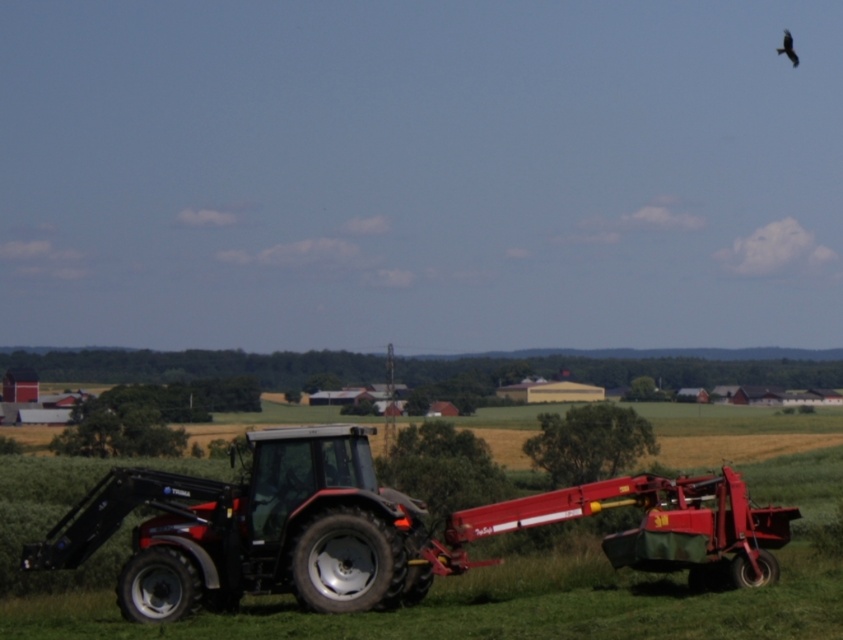
Is matte black tractor at center smaller than black feathered bird at upper right?

Yes.

Is matte black tractor at center in front of black feathered bird at upper right?

Yes, matte black tractor at center is in front of black feathered bird at upper right.

Is point (317, 561) closer to viewer compared to point (784, 45)?

Yes, it is in front of point (784, 45).

Identify the location of matte black tractor at center. Image resolution: width=843 pixels, height=640 pixels. (377, 529).